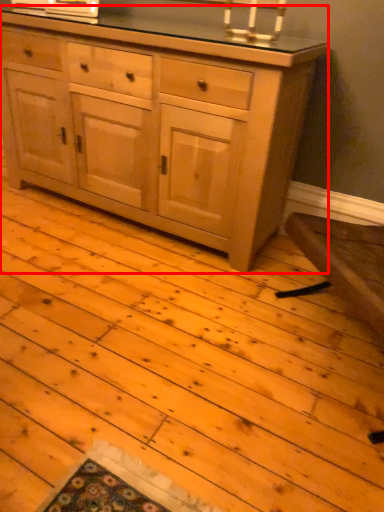
Question: From the image's perspective, what is the correct spatial positioning of chest of drawers (annotated by the red box) in reference to candle holder?

Choices:
 (A) above
 (B) below

Answer: (B)